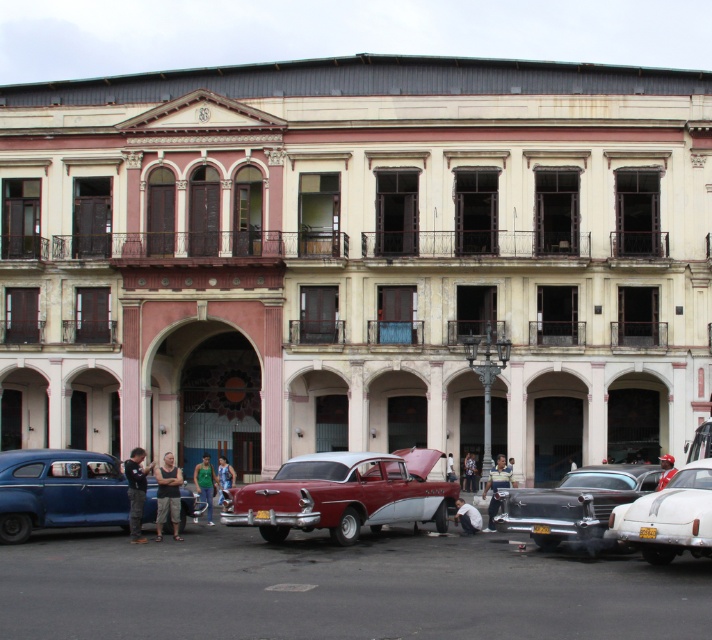
Question: Is red fabric cap at center below dark blue jeans at center?

Choices:
 (A) no
 (B) yes

Answer: (A)

Question: Which is farther from the denim jacket at lower center?

Choices:
 (A) matte blue car at lower left
 (B) shiny black car at center

Answer: (A)

Question: Is the position of matte blue car at lower left less distant than that of shiny black car at center?

Choices:
 (A) no
 (B) yes

Answer: (A)

Question: Which of the following is the farthest from the observer?

Choices:
 (A) denim jacket at lower center
 (B) striped shirt at center
 (C) light blue jeans at center
 (D) matte blue car at lower left

Answer: (A)

Question: Can you confirm if dark blue shirt at lower left is wider than green fabric shirt at center?

Choices:
 (A) no
 (B) yes

Answer: (B)

Question: Which of these objects is positioned closest to the dark gray tank top at center?

Choices:
 (A) shiny black car at center
 (B) green fabric shirt at center
 (C) blue denim jeans at center
 (D) dark blue jeans at center

Answer: (B)